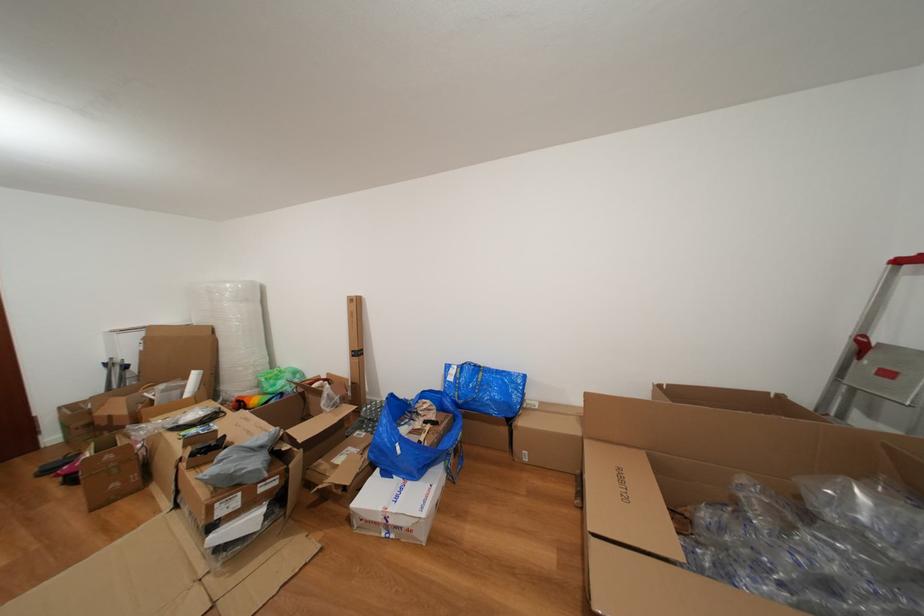
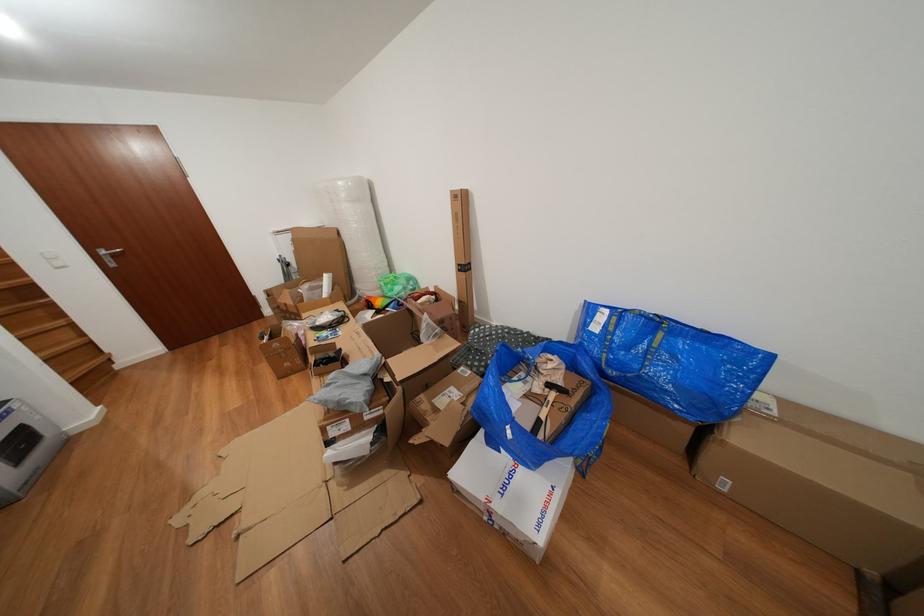
Find the pixel in the second image that matches pixel 282 406 in the first image.

(399, 310)